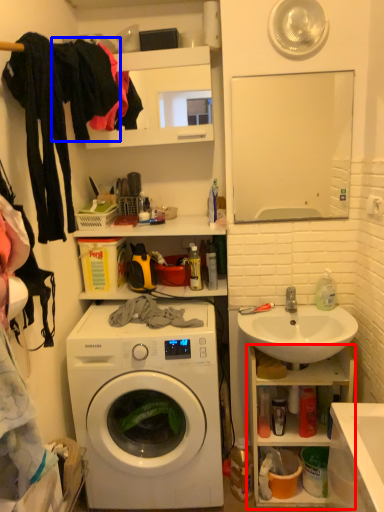
Question: Among these objects, which one is nearest to the camera, cabinet (highlighted by a red box) or clothing (highlighted by a blue box)?

Choices:
 (A) cabinet
 (B) clothing

Answer: (B)